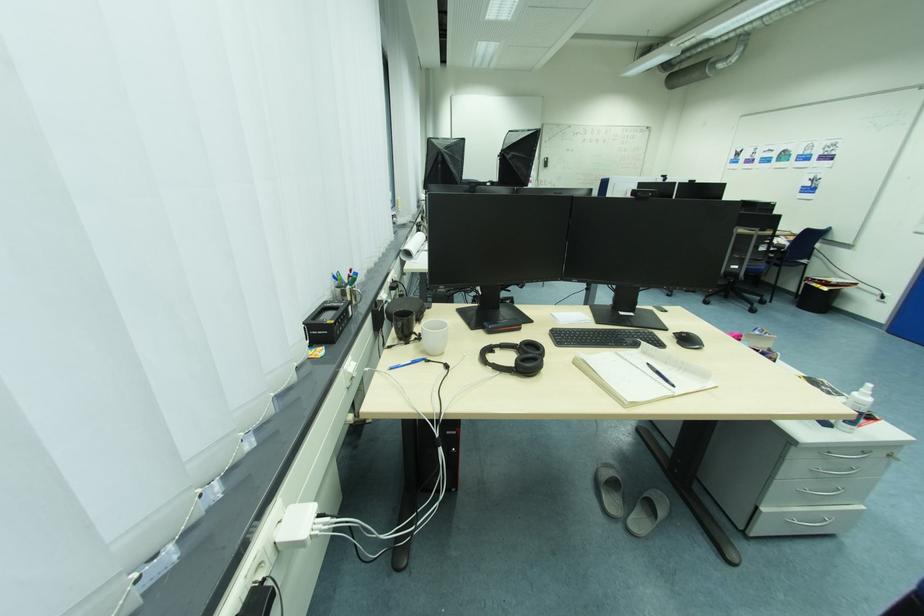
Which object does [407,363] point to?

It corresponds to the black pen in the image.